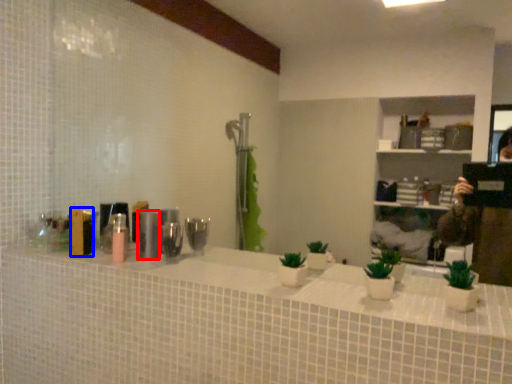
Question: Which object is closer to the camera taking this photo, toiletry (highlighted by a red box) or toiletry (highlighted by a blue box)?

Choices:
 (A) toiletry
 (B) toiletry

Answer: (A)